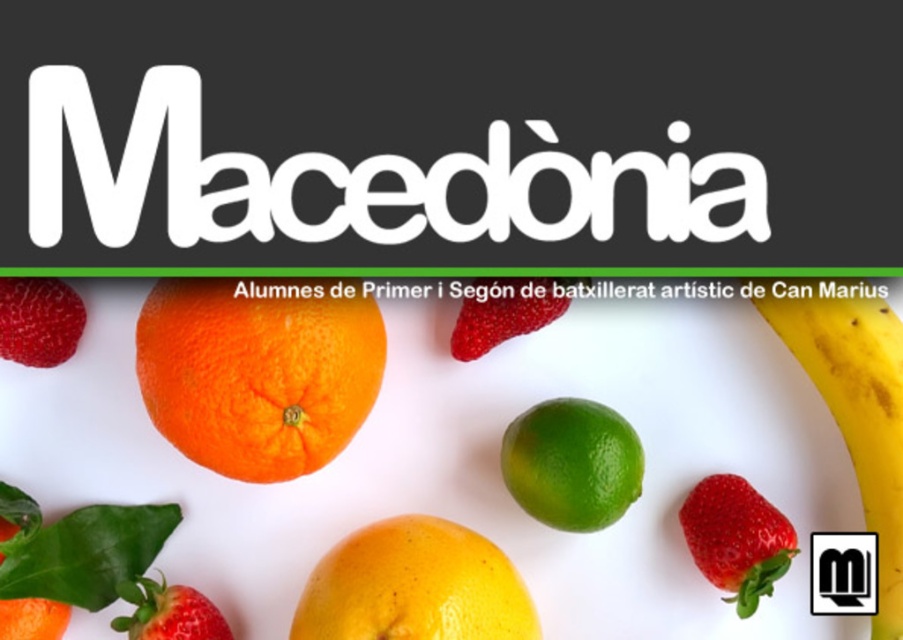
Question: Does orangesmoothorange at center appear under yellow matte grapefruit at center?

Choices:
 (A) no
 (B) yes

Answer: (A)

Question: Which point appears farthest from the camera in this image?

Choices:
 (A) (497, 294)
 (B) (803, 278)

Answer: (A)

Question: Which point is closer to the camera?

Choices:
 (A) (161, 358)
 (B) (731, 520)
 (C) (852, 326)
 (D) (442, 582)

Answer: (A)

Question: In this image, where is orangesmoothorange at center located relative to green matte lime at center?

Choices:
 (A) right
 (B) left

Answer: (B)

Question: Is orangesmoothorange at center below ripe red strawberry at lower left?

Choices:
 (A) no
 (B) yes

Answer: (B)

Question: Which of the following is the closest to the observer?

Choices:
 (A) (518, 300)
 (B) (39, 314)

Answer: (B)